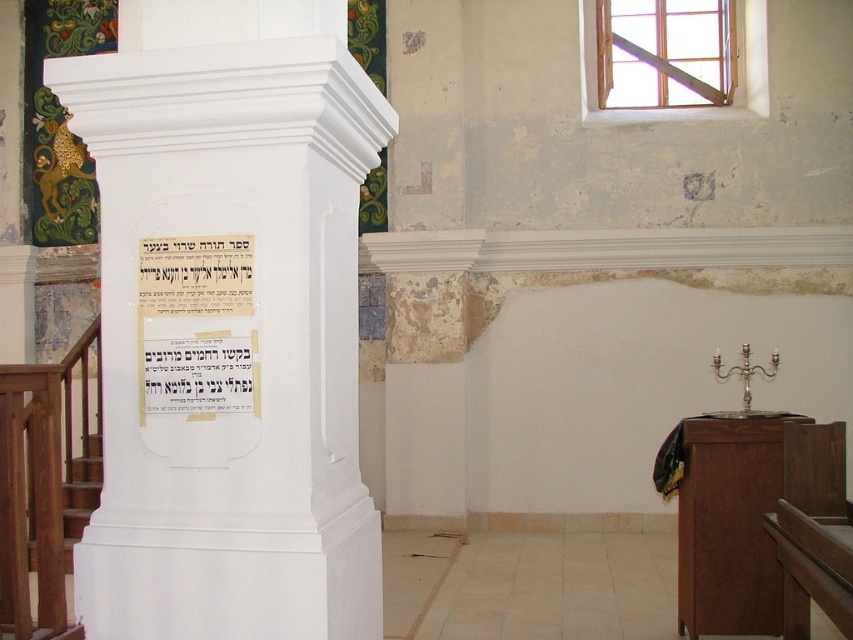
You are standing in the synagogue and want to place a small flower vase between the two points marked as point (303,470) and point (229,276). Which point should the vase be closer to in order to be positioned between them?

The vase should be closer to point (229,276) because point (303,470) is in front of point (229,276), meaning the latter is further back. Placing the vase closer to the back point ensures it is between them.

You are an architect inspecting the synagogue. You notice the matte paper scroll at center and the brown wooden stairs at lower left. Which object is shorter in height?

The matte paper scroll at center is shorter than the brown wooden stairs at lower left.

You are an architect designing a new synagogue and want to ensure proper placement of the white smooth pillar at center and the matte paper scroll at center. Based on their sizes, which object should be placed closer to the entrance to allow visitors to easily see both?

Answer: The white smooth pillar at center is larger in size than the matte paper scroll at center, so placing the pillar closer to the entrance would ensure visitors can easily see both objects as they enter, with the larger pillar drawing attention first and the smaller scroll visible beyond it.